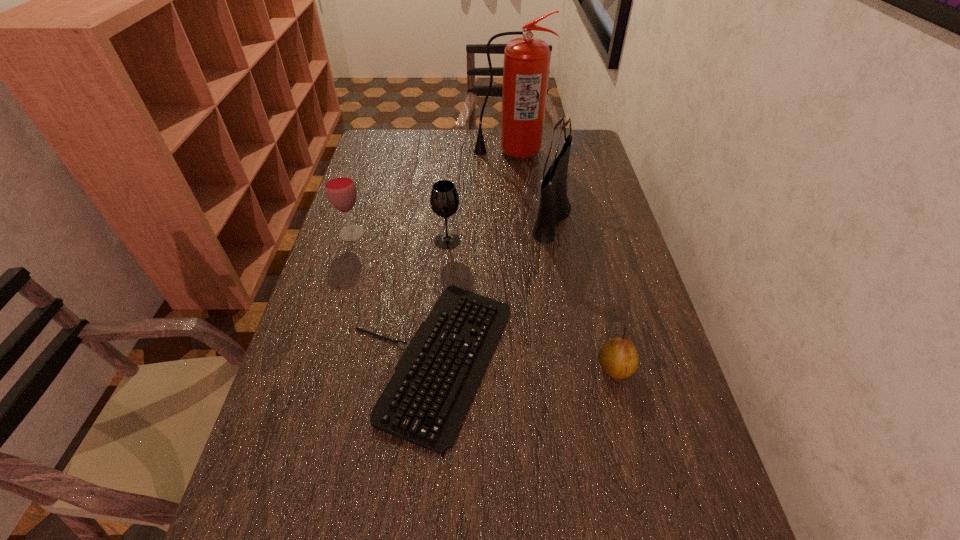
Identify the location of vacant area at the right edge of the desktop. Image resolution: width=960 pixels, height=540 pixels. (582, 169).

This screenshot has height=540, width=960. In the image, there is a desktop. Find the location of `free space at the far left corner`. free space at the far left corner is located at coordinates (366, 156).

The image size is (960, 540). Identify the location of free point at the far right corner. (579, 131).

Where is `free space between the fire extinguisher and the pear`? This screenshot has height=540, width=960. free space between the fire extinguisher and the pear is located at coordinates (563, 260).

This screenshot has height=540, width=960. In order to click on free area in between the fifth shortest object and the left wineglass in this screenshot , I will do `click(452, 225)`.

Where is `free space between the shortest object and the fifth shortest object`? free space between the shortest object and the fifth shortest object is located at coordinates (492, 289).

You are a GUI agent. You are given a task and a screenshot of the screen. Output one action in this format:
    pyautogui.click(x=<x>, y=<y>)
    Task: Click on the vacant point located between the left wineglass and the shortest object
    The image size is (960, 540).
    Given the screenshot: What is the action you would take?
    pyautogui.click(x=392, y=297)

The height and width of the screenshot is (540, 960). I want to click on free space between the second tallest object and the computer keyboard, so click(492, 289).

Find the location of `free area in between the right wineglass and the fifth tallest object`. free area in between the right wineglass and the fifth tallest object is located at coordinates (531, 305).

Identify the location of vacant space in between the shoulder bag and the shortest object. The width and height of the screenshot is (960, 540). (492, 289).